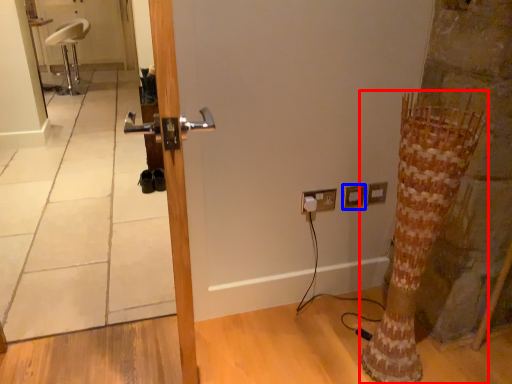
Question: Which object appears farthest to the camera in this image, tree trunk (highlighted by a red box) or electric outlet (highlighted by a blue box)?

Choices:
 (A) tree trunk
 (B) electric outlet

Answer: (B)